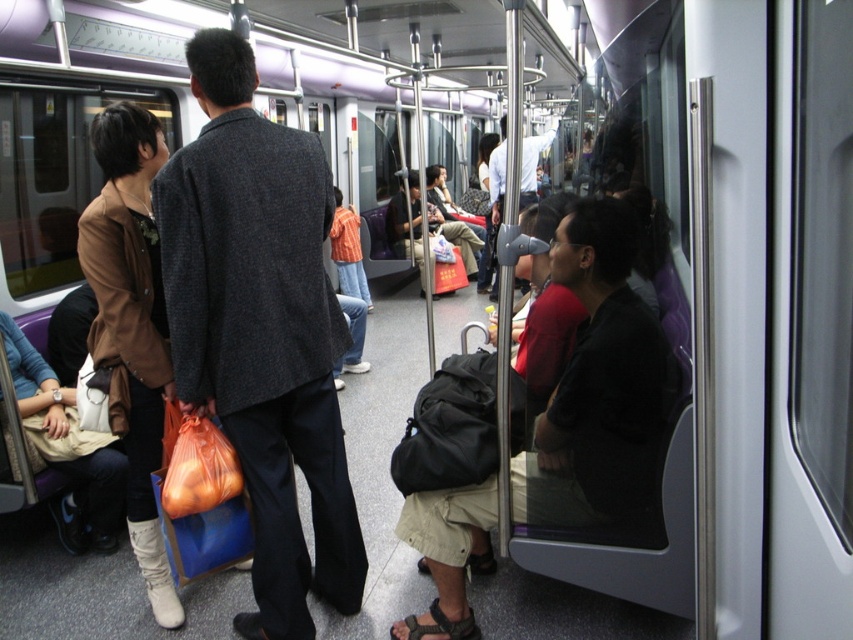
From the picture: You are a passenger in the subway train and want to place a 60 cm wide box between the leather boots at lower left and the beige fabric bag at lower left. Can you fit the box between them?

The distance between the leather boots at lower left and the beige fabric bag at lower left is 61.88 centimeters, so the 60 cm wide box can fit between them since it is slightly narrower than the available space.

You are standing at point [106,529] in the subway train and want to know how far you are from the camera. Can you determine the distance?

The distance between point [106,529] and the camera is 3.00 meters.